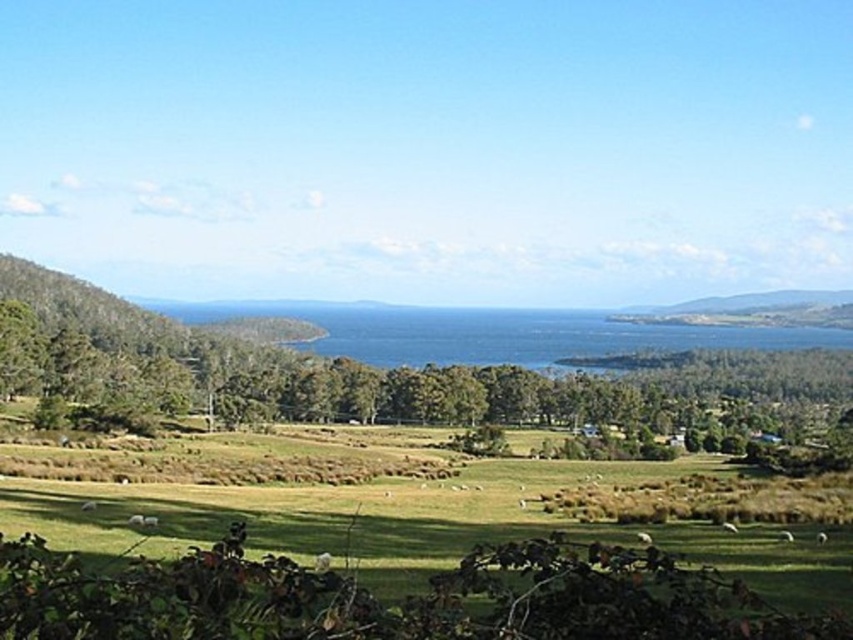
Question: Is green leafy tree at lower center bigger than green grassy hillside at right?

Choices:
 (A) no
 (B) yes

Answer: (B)

Question: Is the position of green leafy tree at lower center more distant than that of green grassy hillside at right?

Choices:
 (A) no
 (B) yes

Answer: (A)

Question: Among these objects, which one is nearest to the camera?

Choices:
 (A) green leafy tree at lower center
 (B) green grassy hillside at right

Answer: (A)

Question: Can you confirm if green leafy tree at lower center is positioned to the left of green grassy hillside at right?

Choices:
 (A) yes
 (B) no

Answer: (A)